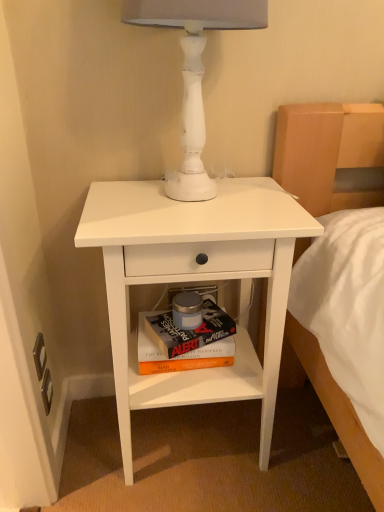
Question: Is white matte nightstand at center taller than white matte table lamp at upper center?

Choices:
 (A) no
 (B) yes

Answer: (B)

Question: Does white matte nightstand at center contain white matte table lamp at upper center?

Choices:
 (A) yes
 (B) no

Answer: (B)

Question: Does white matte nightstand at center appear on the right side of white matte table lamp at upper center?

Choices:
 (A) no
 (B) yes

Answer: (A)

Question: Can you confirm if white matte nightstand at center is wider than white matte table lamp at upper center?

Choices:
 (A) no
 (B) yes

Answer: (B)

Question: Considering the relative sizes of white matte nightstand at center and white matte table lamp at upper center in the image provided, is white matte nightstand at center shorter than white matte table lamp at upper center?

Choices:
 (A) yes
 (B) no

Answer: (B)

Question: Is point (221, 348) positioned closer to the camera than point (142, 276)?

Choices:
 (A) farther
 (B) closer

Answer: (A)

Question: Is hardcover book at center in front of or behind white matte nightstand at center in the image?

Choices:
 (A) front
 (B) behind

Answer: (B)

Question: In the image, is hardcover book at center on the left side or the right side of white matte nightstand at center?

Choices:
 (A) right
 (B) left

Answer: (B)

Question: In terms of width, does hardcover book at center look wider or thinner when compared to white matte nightstand at center?

Choices:
 (A) thin
 (B) wide

Answer: (A)

Question: From the image's perspective, is white matte table lamp at upper center positioned above or below hardcover book at center?

Choices:
 (A) above
 (B) below

Answer: (A)

Question: In terms of size, does white matte table lamp at upper center appear bigger or smaller than hardcover book at center?

Choices:
 (A) big
 (B) small

Answer: (A)

Question: Considering the positions of white matte table lamp at upper center and hardcover book at center in the image, is white matte table lamp at upper center taller or shorter than hardcover book at center?

Choices:
 (A) tall
 (B) short

Answer: (A)

Question: In the image, is white matte table lamp at upper center on the left side or the right side of hardcover book at center?

Choices:
 (A) right
 (B) left

Answer: (A)

Question: From the image's perspective, relative to hardcover book at center, is white matte nightstand at center above or below?

Choices:
 (A) below
 (B) above

Answer: (B)

Question: From a real-world perspective, is white matte nightstand at center above or below hardcover book at center?

Choices:
 (A) above
 (B) below

Answer: (A)